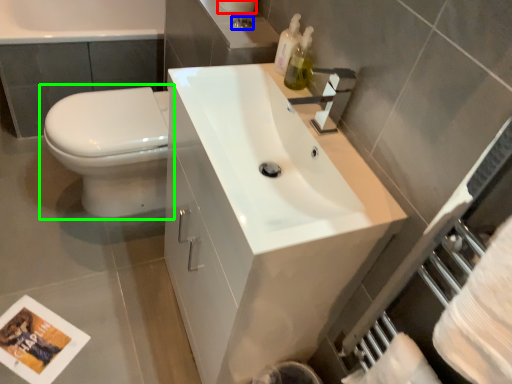
Question: Estimate the real-world distances between objects in this image. Which object is farther from toilet paper (highlighted by a red box), plumbing fixture (highlighted by a blue box) or toilet (highlighted by a green box)?

Choices:
 (A) plumbing fixture
 (B) toilet

Answer: (B)